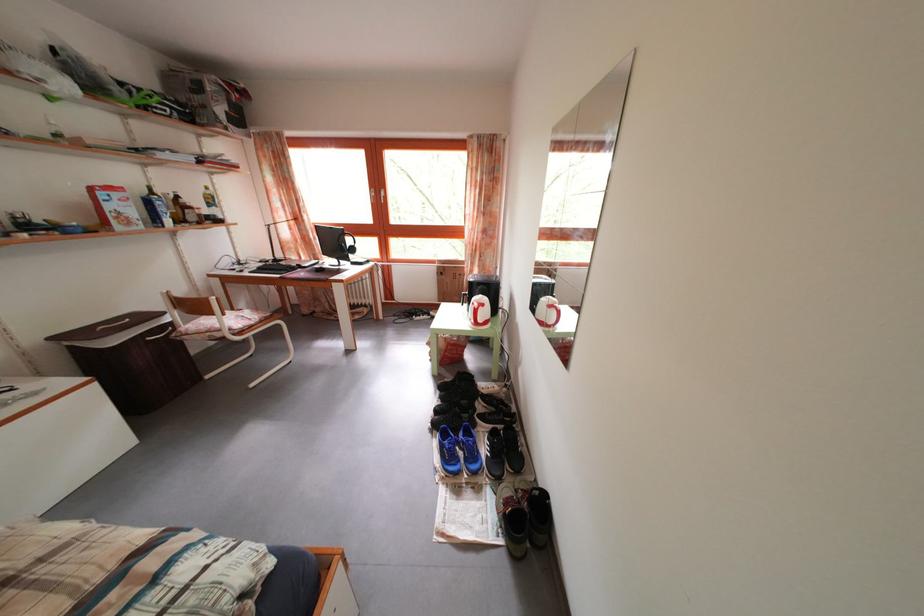
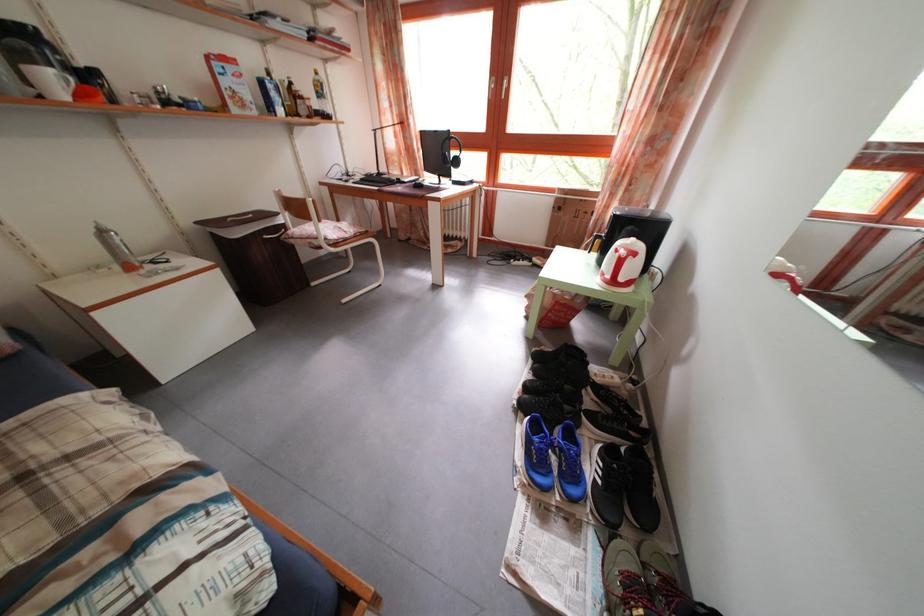
Locate, in the second image, the point that corresponds to point 232,322 in the first image.

(327, 228)